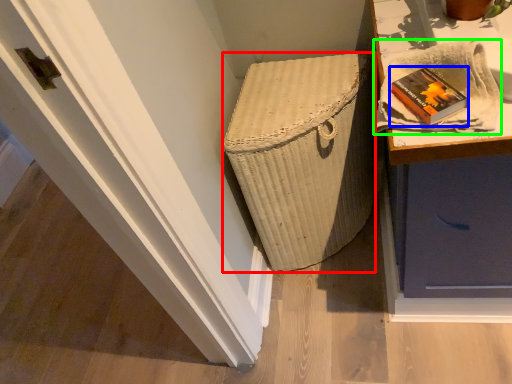
Question: Based on their relative distances, which object is nearer to basket container (highlighted by a red box)? Choose from book (highlighted by a blue box) and cloth (highlighted by a green box).

Choices:
 (A) book
 (B) cloth

Answer: (B)